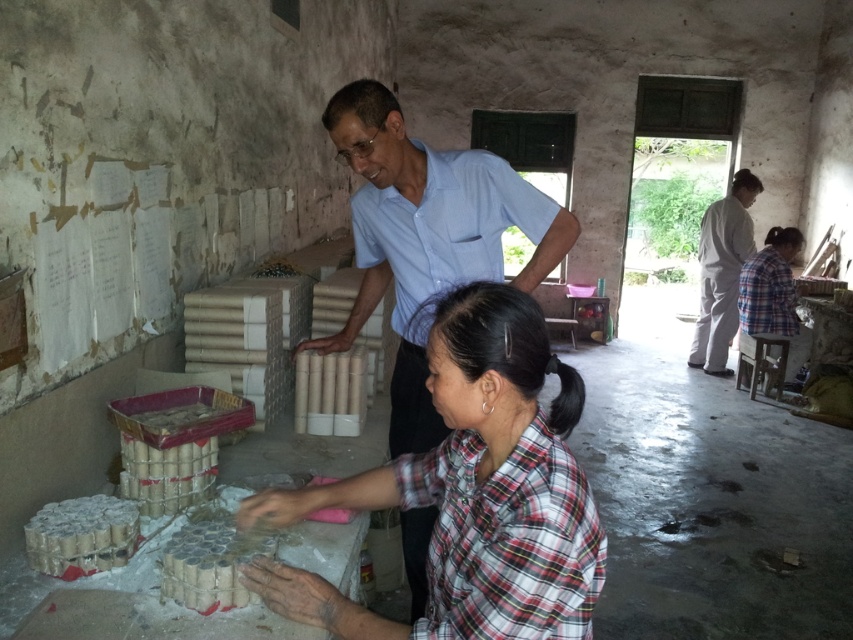
Is point (712, 266) farther from camera compared to point (801, 346)?

Yes, it is behind point (801, 346).

Who is higher up, plaid fabric shirt at right or plaid fabric shirt at lower right?

plaid fabric shirt at right is higher up.

Who is more forward, (741, 237) or (746, 305)?

Point (746, 305)

Where is `plaid fabric shirt at right`? Image resolution: width=853 pixels, height=640 pixels. plaid fabric shirt at right is located at coordinates (722, 273).

Does plaid fabric shirt at center appear on the left side of plaid fabric shirt at lower right?

Yes, plaid fabric shirt at center is to the left of plaid fabric shirt at lower right.

Is plaid fabric shirt at center shorter than plaid fabric shirt at lower right?

Yes.

Is point (514, 323) farther from camera compared to point (743, 305)?

No.

Where is `plaid fabric shirt at center`? The height and width of the screenshot is (640, 853). plaid fabric shirt at center is located at coordinates (467, 496).

Looking at this image, how distant is light blue cotton shirt at upper center from plaid fabric shirt at lower right?

light blue cotton shirt at upper center is 4.46 meters away from plaid fabric shirt at lower right.

Who is positioned more to the right, light blue cotton shirt at upper center or plaid fabric shirt at lower right?

From the viewer's perspective, plaid fabric shirt at lower right appears more on the right side.

Describe the element at coordinates (445, 228) in the screenshot. The height and width of the screenshot is (640, 853). I see `light blue cotton shirt at upper center` at that location.

Find the location of a particular element. The height and width of the screenshot is (640, 853). light blue cotton shirt at upper center is located at coordinates [445, 228].